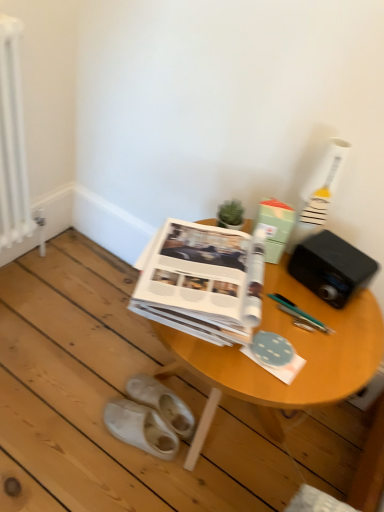
Where is `vacant space in front of black plastic speaker at upper right`? The image size is (384, 512). vacant space in front of black plastic speaker at upper right is located at coordinates (333, 328).